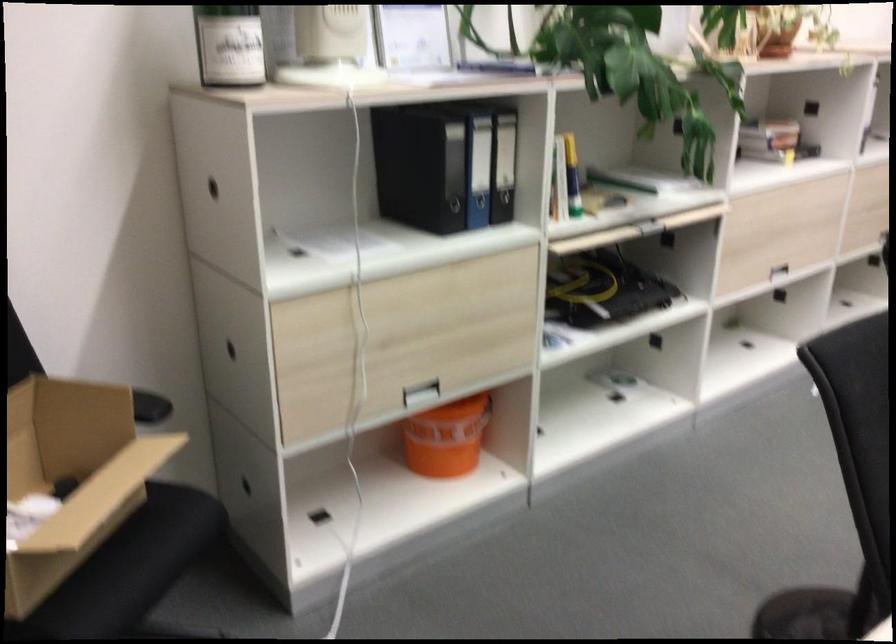
Which object does [446,438] point to?

It refers to a orange bucket.